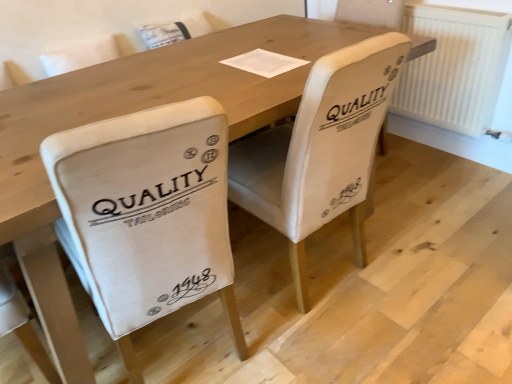
Find the location of `beige fabric chair at center, which appears as the 2th chair when viewed from the right`. beige fabric chair at center, which appears as the 2th chair when viewed from the right is located at coordinates (147, 214).

Image resolution: width=512 pixels, height=384 pixels. What do you see at coordinates (454, 67) in the screenshot?
I see `white textured radiator at right` at bounding box center [454, 67].

What is the approximate width of white textured radiator at right?

white textured radiator at right is 4.35 inches wide.

Where is `white fabric chair at center, the 1th chair when ordered from right to left`? The image size is (512, 384). white fabric chair at center, the 1th chair when ordered from right to left is located at coordinates (321, 149).

The height and width of the screenshot is (384, 512). What do you see at coordinates (264, 63) in the screenshot?
I see `white paper at center` at bounding box center [264, 63].

Find the location of `beige fabric chair at center, which appears as the 2th chair when viewed from the right`. beige fabric chair at center, which appears as the 2th chair when viewed from the right is located at coordinates (147, 214).

Is there a large distance between white textured radiator at right and white paper at center?

white textured radiator at right is positioned a significant distance from white paper at center.

Is point (455, 98) positioned before point (251, 53)?

No, (455, 98) is behind (251, 53).

Considering the relative sizes of white textured radiator at right and white paper at center in the image provided, is white textured radiator at right thinner than white paper at center?

Indeed, white textured radiator at right has a lesser width compared to white paper at center.

Consider the image. Which object is further away from the camera taking this photo, white fabric chair at center, which ranks as the 2th chair in left-to-right order, or white textured radiator at right?

white textured radiator at right is further from the camera.

Could you tell me if white fabric chair at center, which ranks as the 2th chair in left-to-right order, is turned towards white textured radiator at right?

No, white fabric chair at center, which ranks as the 2th chair in left-to-right order, does not turn towards white textured radiator at right.

Consider the image. Is white fabric chair at center, which ranks as the 2th chair in left-to-right order, at the left side of white textured radiator at right?

Correct, you'll find white fabric chair at center, which ranks as the 2th chair in left-to-right order, to the left of white textured radiator at right.

Measure the distance from white fabric chair at center, the 1th chair when ordered from right to left, to white textured radiator at right.

The distance of white fabric chair at center, the 1th chair when ordered from right to left, from white textured radiator at right is 3.70 feet.

In the image, is white textured radiator at right positioned in front of or behind white fabric chair at center, which ranks as the 2th chair in left-to-right order?

In the image, white textured radiator at right appears behind white fabric chair at center, which ranks as the 2th chair in left-to-right order.

Is white textured radiator at right not close to white fabric chair at center, the 1th chair when ordered from right to left?

white textured radiator at right is positioned a significant distance from white fabric chair at center, the 1th chair when ordered from right to left.

Choose the correct answer: Is white textured radiator at right inside white fabric chair at center, which ranks as the 2th chair in left-to-right order, or outside it?

white textured radiator at right is outside white fabric chair at center, which ranks as the 2th chair in left-to-right order.

Measure the distance from beige fabric chair at center, which appears as the 2th chair when viewed from the right, to white fabric chair at center, the 1th chair when ordered from right to left.

They are 17.32 inches apart.

Between beige fabric chair at center, which appears as the 2th chair when viewed from the right, and white fabric chair at center, which ranks as the 2th chair in left-to-right order, which one appears on the left side from the viewer's perspective?

Positioned to the left is beige fabric chair at center, which appears as the 2th chair when viewed from the right.

Who is taller, beige fabric chair at center, which appears as the 2th chair when viewed from the right, or white fabric chair at center, the 1th chair when ordered from right to left?

With more height is white fabric chair at center, the 1th chair when ordered from right to left.

Is beige fabric chair at center, acting as the 1th chair starting from the left, inside or outside of white paper at center?

beige fabric chair at center, acting as the 1th chair starting from the left, is spatially situated outside white paper at center.

From the image's perspective, which is above, beige fabric chair at center, which appears as the 2th chair when viewed from the right, or white paper at center?

white paper at center is shown above in the image.

Considering the relative sizes of beige fabric chair at center, which appears as the 2th chair when viewed from the right, and white paper at center in the image provided, is beige fabric chair at center, which appears as the 2th chair when viewed from the right, smaller than white paper at center?

No, beige fabric chair at center, which appears as the 2th chair when viewed from the right, is not smaller than white paper at center.

Does beige fabric chair at center, acting as the 1th chair starting from the left, turn towards white paper at center?

No, beige fabric chair at center, acting as the 1th chair starting from the left, is not turned towards white paper at center.

From a real-world perspective, which is physically below, white paper at center or white textured radiator at right?

white textured radiator at right, from a real-world perspective.

Is white textured radiator at right a part of white paper at center?

No, white textured radiator at right is not surrounded by white paper at center.

Locate an element on the screen. This screenshot has height=384, width=512. radiator above the white paper at center (from the image's perspective) is located at coordinates (454, 67).

Is the surface of white paper at center in direct contact with white textured radiator at right?

No, white paper at center is not making contact with white textured radiator at right.

You are a GUI agent. You are given a task and a screenshot of the screen. Output one action in this format:
    pyautogui.click(x=<x>, y=<y>)
    Task: Click on the 2nd chair in front of the white paper at center
    This screenshot has width=512, height=384.
    Given the screenshot: What is the action you would take?
    (x=147, y=214)

Is beige fabric chair at center, acting as the 1th chair starting from the left, at the back of white paper at center?

No, white paper at center is not facing the opposite direction of beige fabric chair at center, acting as the 1th chair starting from the left.

Looking at this image, can you confirm if white paper at center is positioned to the left of beige fabric chair at center, acting as the 1th chair starting from the left?

Incorrect, white paper at center is not on the left side of beige fabric chair at center, acting as the 1th chair starting from the left.

Are white paper at center and beige fabric chair at center, acting as the 1th chair starting from the left, located far from each other?

No, there isn't a large distance between white paper at center and beige fabric chair at center, acting as the 1th chair starting from the left.

Where is `radiator beneath the white paper at center (from a real-world perspective)`? radiator beneath the white paper at center (from a real-world perspective) is located at coordinates (454, 67).

This screenshot has height=384, width=512. In order to click on radiator above the white fabric chair at center, which ranks as the 2th chair in left-to-right order (from the image's perspective) in this screenshot , I will do `click(454, 67)`.

Considering their positions, is white textured radiator at right positioned further to beige fabric chair at center, acting as the 1th chair starting from the left, than white paper at center?

white textured radiator at right lies further to beige fabric chair at center, acting as the 1th chair starting from the left, than the other object.

Considering their positions, is white textured radiator at right positioned further to white fabric chair at center, the 1th chair when ordered from right to left, than beige fabric chair at center, acting as the 1th chair starting from the left?

white textured radiator at right is positioned further to the anchor white fabric chair at center, the 1th chair when ordered from right to left.

Considering their positions, is white paper at center positioned further to white fabric chair at center, the 1th chair when ordered from right to left, than white textured radiator at right?

Based on the image, white textured radiator at right appears to be further to white fabric chair at center, the 1th chair when ordered from right to left.

Looking at the image, which one is located closer to white textured radiator at right, white fabric chair at center, which ranks as the 2th chair in left-to-right order, or white paper at center?

white paper at center is positioned closer to the anchor white textured radiator at right.

Based on their spatial positions, is white textured radiator at right or white fabric chair at center, the 1th chair when ordered from right to left, further from white paper at center?

white textured radiator at right lies further to white paper at center than the other object.

Estimate the real-world distances between objects in this image. Which object is closer to white paper at center, white fabric chair at center, which ranks as the 2th chair in left-to-right order, or white textured radiator at right?

white fabric chair at center, which ranks as the 2th chair in left-to-right order, lies closer to white paper at center than the other object.

Considering their positions, is white paper at center positioned further to white textured radiator at right than white fabric chair at center, the 1th chair when ordered from right to left?

white fabric chair at center, the 1th chair when ordered from right to left, is further to white textured radiator at right.

Estimate the real-world distances between objects in this image. Which object is closer to white paper at center, white textured radiator at right or beige fabric chair at center, acting as the 1th chair starting from the left?

Among the two, beige fabric chair at center, acting as the 1th chair starting from the left, is located nearer to white paper at center.

Locate an element on the screen. This screenshot has height=384, width=512. chair between beige fabric chair at center, acting as the 1th chair starting from the left, and white paper at center, along the z-axis is located at coordinates (321, 149).

This screenshot has width=512, height=384. Identify the location of chair situated between white paper at center and white textured radiator at right from left to right. (321, 149).

The image size is (512, 384). What are the coordinates of `chair between beige fabric chair at center, which appears as the 2th chair when viewed from the right, and white textured radiator at right` in the screenshot? It's located at (321, 149).

Locate an element on the screen. paper located between beige fabric chair at center, which appears as the 2th chair when viewed from the right, and white textured radiator at right in the left-right direction is located at coordinates (264, 63).